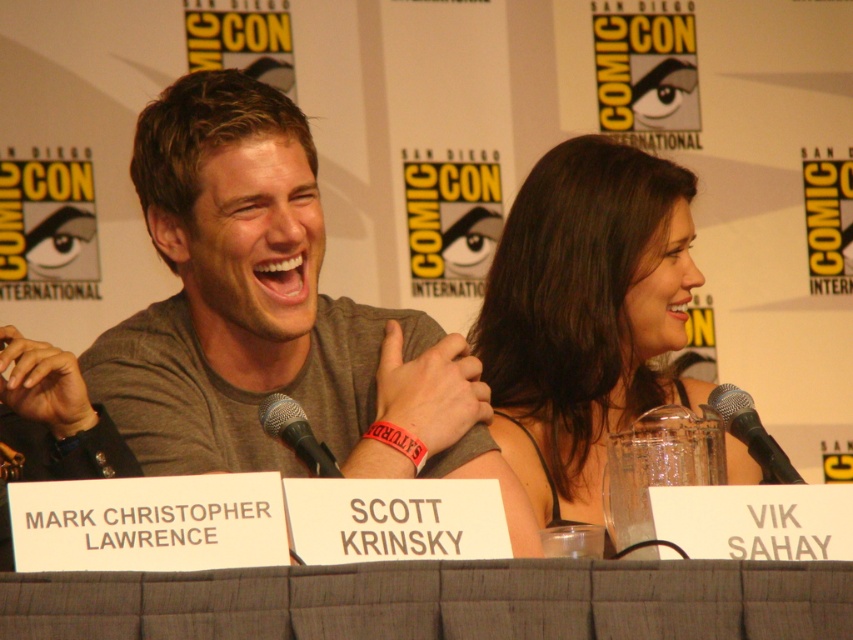
Can you confirm if gray cotton shirt at center is shorter than black metallic microphone at center?

No, gray cotton shirt at center is not shorter than black metallic microphone at center.

Measure the distance between point (294, 218) and camera.

Point (294, 218) is 2.02 meters away from camera.

Does point (178, 461) come in front of point (740, 440)?

No, (178, 461) is further to viewer.

Locate an element on the screen. This screenshot has width=853, height=640. gray cotton shirt at center is located at coordinates (274, 316).

Does gray cotton shirt at center have a greater width compared to black mesh microphone at center?

Yes.

Can you confirm if gray cotton shirt at center is shorter than black mesh microphone at center?

No, gray cotton shirt at center is not shorter than black mesh microphone at center.

Between point (247, 177) and point (302, 420), which one is positioned behind?

The point (247, 177) is more distant.

This screenshot has height=640, width=853. In order to click on gray cotton shirt at center in this screenshot , I will do `click(274, 316)`.

Is point (647, 205) behind point (782, 481)?

Yes, it is behind point (782, 481).

Describe the element at coordinates (585, 316) in the screenshot. This screenshot has width=853, height=640. I see `smooth brown hair at center` at that location.

Is point (538, 241) farther from viewer compared to point (730, 417)?

That is True.

Find the location of a particular element. This screenshot has height=640, width=853. smooth brown hair at center is located at coordinates (585, 316).